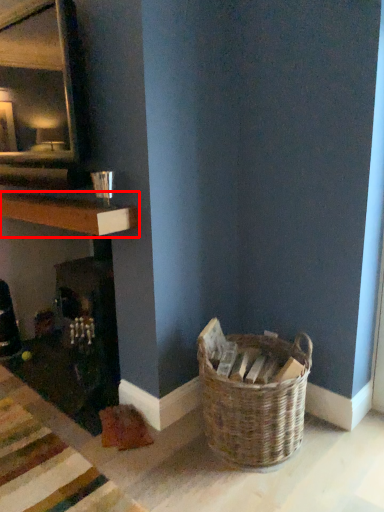
Question: Observing the image, what is the correct spatial positioning of shelf (annotated by the red box) in reference to picnic basket?

Choices:
 (A) left
 (B) right

Answer: (A)